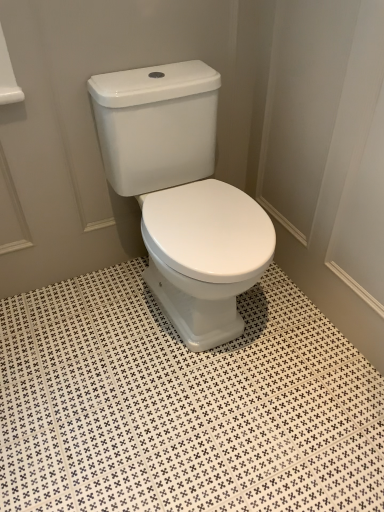
Question: In terms of height, does white glossy ceramic tile at center look taller or shorter compared to white glossy toilet at center?

Choices:
 (A) tall
 (B) short

Answer: (B)

Question: Relative to white glossy toilet at center, is white glossy ceramic tile at center in front or behind?

Choices:
 (A) front
 (B) behind

Answer: (A)

Question: From the image's perspective, relative to white glossy toilet at center, is white glossy ceramic tile at center above or below?

Choices:
 (A) below
 (B) above

Answer: (A)

Question: Considering the positions of white glossy toilet at center and white glossy ceramic tile at center in the image, is white glossy toilet at center bigger or smaller than white glossy ceramic tile at center?

Choices:
 (A) big
 (B) small

Answer: (A)

Question: Considering the positions of white glossy toilet at center and white glossy ceramic tile at center in the image, is white glossy toilet at center wider or thinner than white glossy ceramic tile at center?

Choices:
 (A) wide
 (B) thin

Answer: (B)

Question: Relative to white glossy ceramic tile at center, is white glossy toilet at center in front or behind?

Choices:
 (A) behind
 (B) front

Answer: (A)

Question: From a real-world perspective, is white glossy toilet at center above or below white glossy ceramic tile at center?

Choices:
 (A) below
 (B) above

Answer: (B)